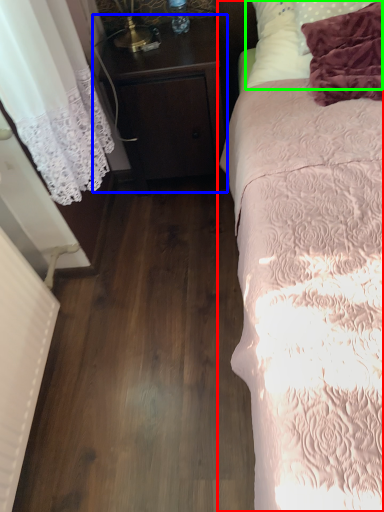
Question: Which object is positioned farthest from bed (highlighted by a red box)? Select from nightstand (highlighted by a blue box) and pillow (highlighted by a green box).

Choices:
 (A) nightstand
 (B) pillow

Answer: (A)